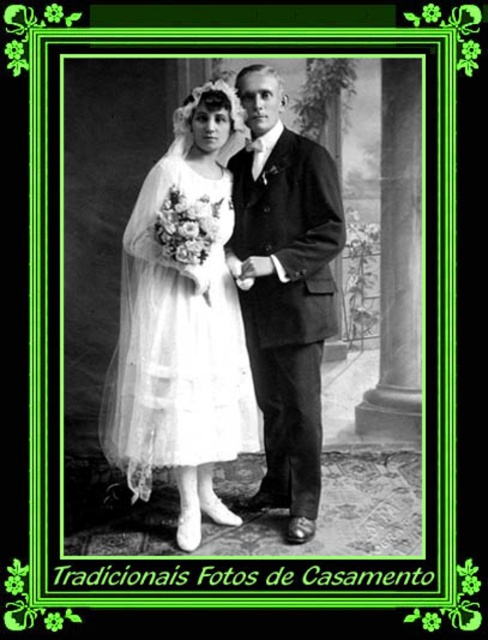
Question: Is white lace dress at center thinner than translucent white tulle dress at center?

Choices:
 (A) yes
 (B) no

Answer: (B)

Question: Estimate the real-world distances between objects in this image. Which object is closer to the translucent white tulle dress at center?

Choices:
 (A) white lace dress at center
 (B) smooth black suit at center

Answer: (A)

Question: Is the position of white lace dress at center more distant than that of smooth black suit at center?

Choices:
 (A) no
 (B) yes

Answer: (A)

Question: Which of the following is the farthest from the observer?

Choices:
 (A) smooth black suit at center
 (B) translucent white tulle dress at center
 (C) white lace dress at center

Answer: (A)

Question: Among these points, which one is nearest to the camera?

Choices:
 (A) (272, 253)
 (B) (144, 266)
 (C) (171, 308)

Answer: (C)

Question: Is white lace dress at center below smooth black suit at center?

Choices:
 (A) no
 (B) yes

Answer: (A)